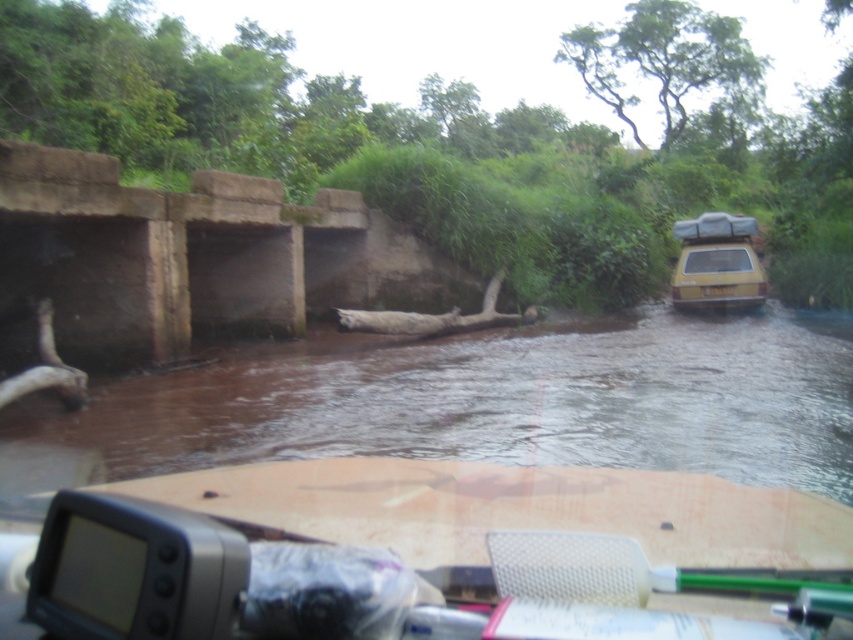
You are a passenger in a car and you see the brown muddy water at center and the yellow matte car at right through the window. Which object is closer to the left side of the window?

The brown muddy water at center is positioned on the left side of yellow matte car at right, so it is closer to the left side of the window.